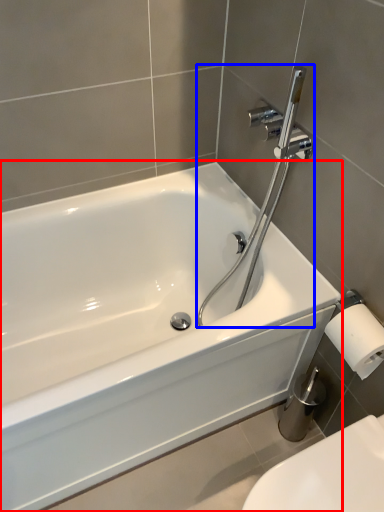
Question: Which object appears farthest to the camera in this image, bathtub (highlighted by a red box) or plumbing fixture (highlighted by a blue box)?

Choices:
 (A) bathtub
 (B) plumbing fixture

Answer: (B)